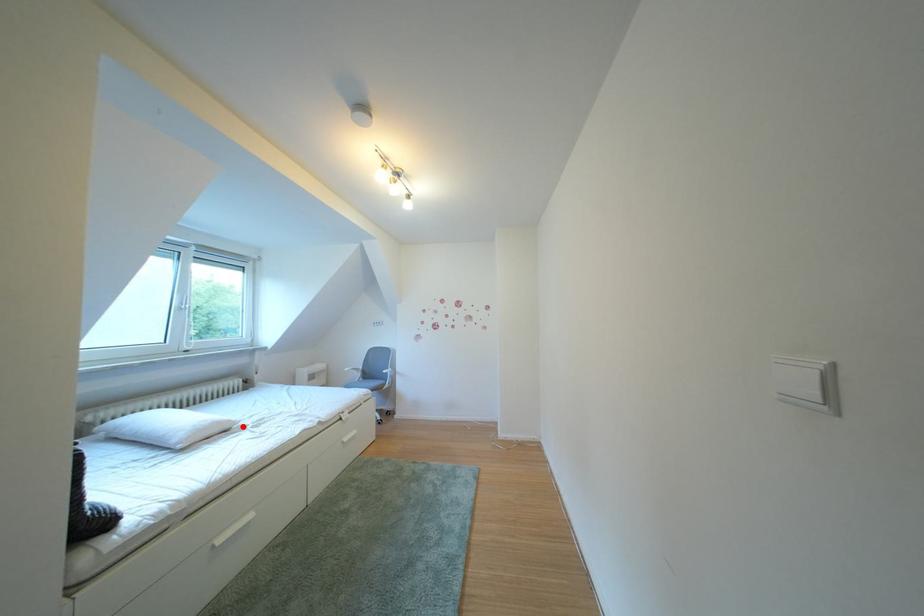
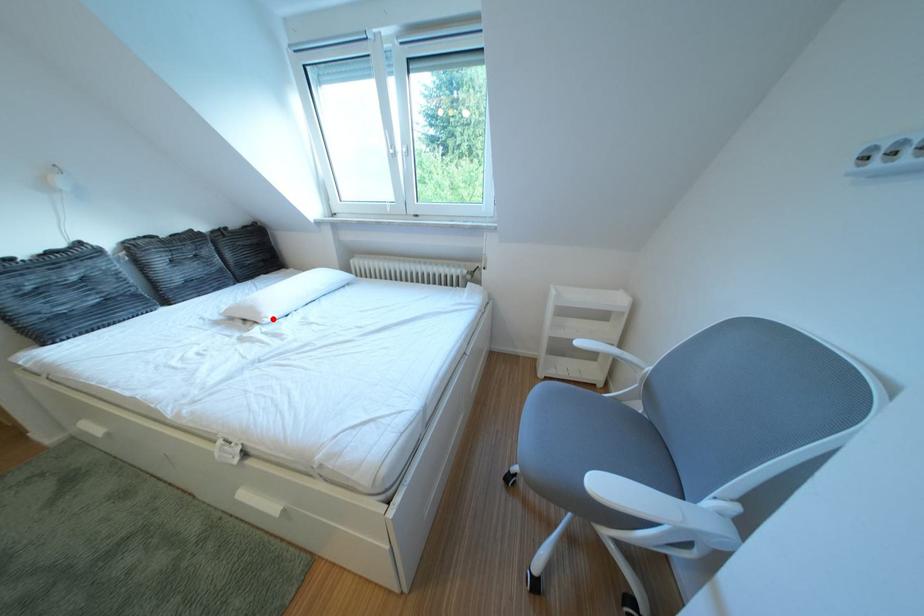
I am providing you with two images of the same scene from different viewpoints. A red point is marked on the first image and another point is marked on the second image. Are the points marked in image1 and image2 representing the same 3D position?

Yes